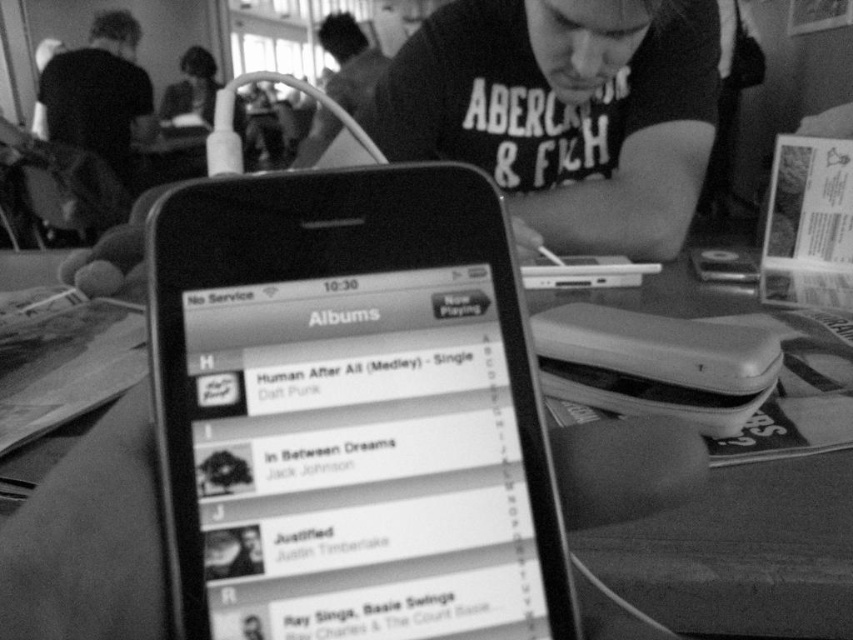
You are holding a ruler and want to measure the distance between your hand and the smooth black phone at center. If your hand is exactly 50 cm away from the camera, can you reach the phone without moving your hand closer or farther?

The smooth black phone at center is 47.90 centimeters from the camera. Since your hand is 50 cm away, it is farther than the phone, so you cannot reach it without moving your hand closer.

You are designing a phone stand that needs to accommodate both the smooth glossy phone at center and the smooth plastic phone at center. Since the stand must be tall enough for the taller phone, which one should the stand be designed to hold?

The stand should be designed to accommodate the smooth plastic phone at center because it is taller than the smooth glossy phone at center.